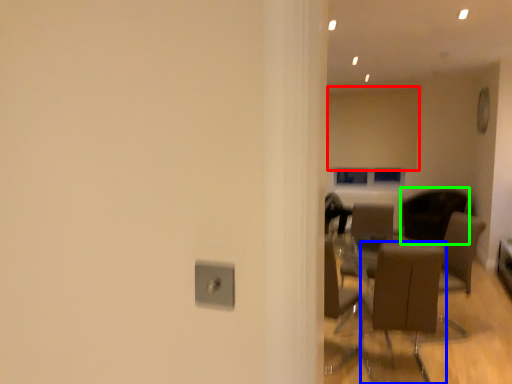
Question: Estimate the real-world distances between objects in this image. Which object is farther from curtain (highlighted by a red box), chair (highlighted by a blue box) or chair (highlighted by a green box)?

Choices:
 (A) chair
 (B) chair

Answer: (A)